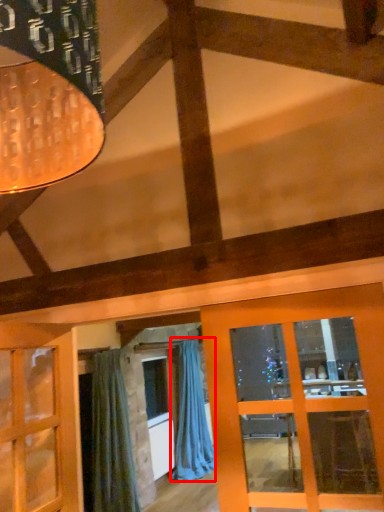
Question: From the image's perspective, considering the relative positions of curtain (annotated by the red box) and curtain in the image provided, where is curtain (annotated by the red box) located with respect to the staircase?

Choices:
 (A) above
 (B) below

Answer: (B)